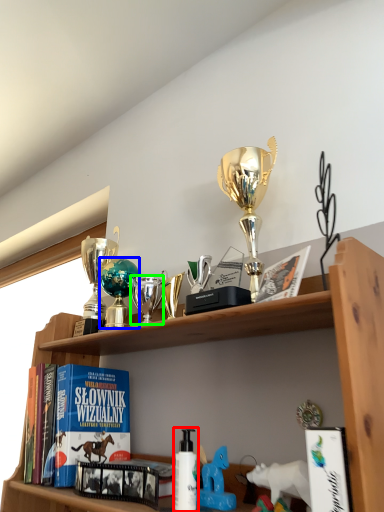
Question: Which object is positioned closest to bottle (highlighted by a red box)? Select from toy (highlighted by a blue box) and toy (highlighted by a green box).

Choices:
 (A) toy
 (B) toy

Answer: (B)